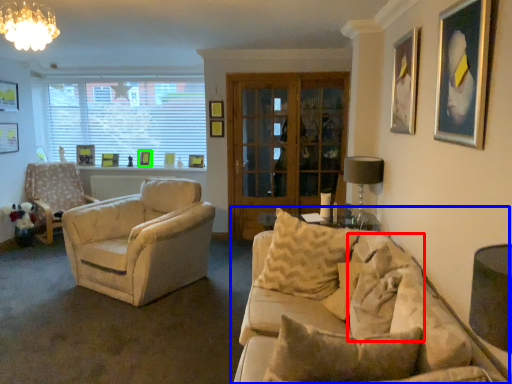
Question: Estimate the real-world distances between objects in this image. Which object is closer to pillow (highlighted by a red box), studio couch (highlighted by a blue box) or picture frame (highlighted by a green box)?

Choices:
 (A) studio couch
 (B) picture frame

Answer: (A)